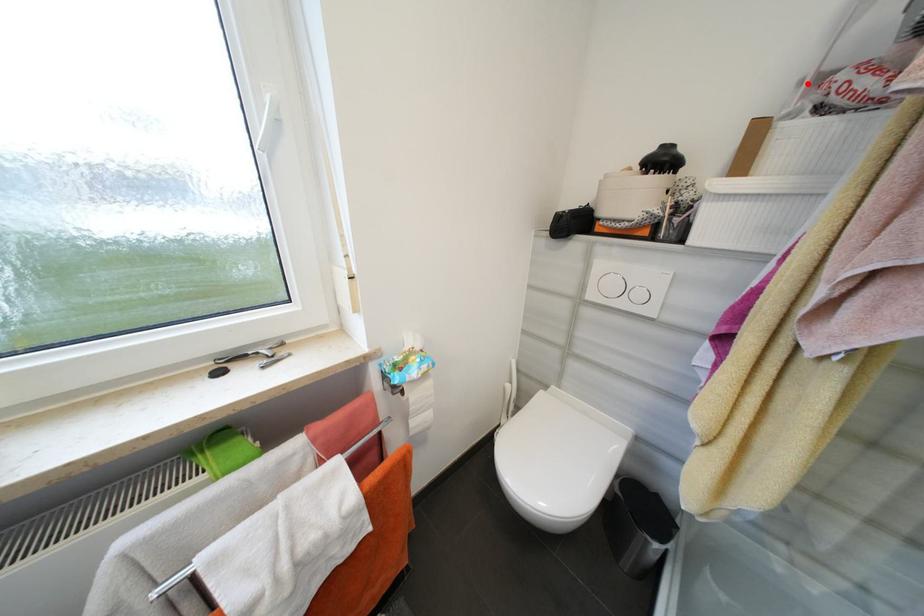
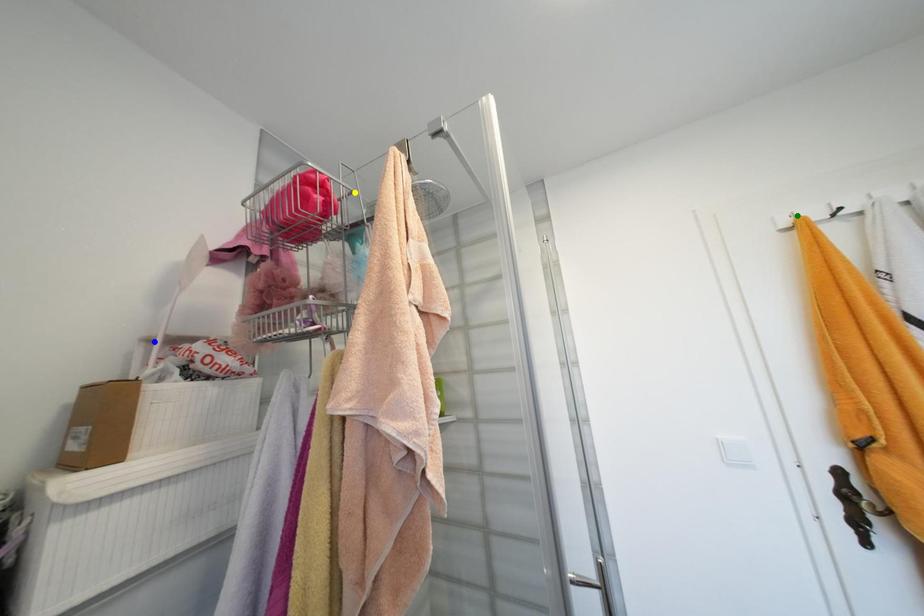
Question: I am providing you with two images of the same scene from different viewpoints. A red point is marked on the first image. You are given multiple points on the second image. In image 2, which mark is for the same physical point as the one in image 1?

Choices:
 (A) green point
 (B) yellow point
 (C) blue point

Answer: (C)